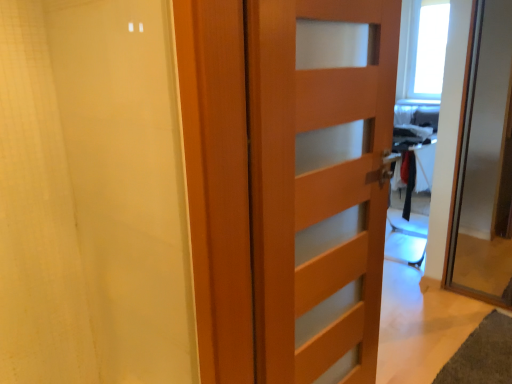
The height and width of the screenshot is (384, 512). In order to click on wooden door at right, arranged as the 2th door when viewed from the left in this screenshot , I will do `click(485, 164)`.

You are a GUI agent. You are given a task and a screenshot of the screen. Output one action in this format:
    pyautogui.click(x=<x>, y=<y>)
    Task: Click on the wooden door at right, arranged as the 2th door when viewed from the left
    The width and height of the screenshot is (512, 384).
    Given the screenshot: What is the action you would take?
    pyautogui.click(x=485, y=164)

How different are the orientations of wooden door at right, which appears as the first door when viewed from the right, and wooden door at center, the 1th door positioned from the left, in degrees?

88 degrees separate the facing orientations of wooden door at right, which appears as the first door when viewed from the right, and wooden door at center, the 1th door positioned from the left.

How much distance is there between wooden door at right, arranged as the 2th door when viewed from the left, and wooden door at center, the 1th door positioned from the left?

wooden door at right, arranged as the 2th door when viewed from the left, and wooden door at center, the 1th door positioned from the left, are 5.17 feet apart from each other.

The image size is (512, 384). What are the coordinates of `door that appears below the wooden door at right, which appears as the first door when viewed from the right (from a real-world perspective)` in the screenshot? It's located at (318, 187).

Based on the photo, can you confirm if wooden door at right, arranged as the 2th door when viewed from the left, is taller than wooden door at center, which is the second door in right-to-left order?

In fact, wooden door at right, arranged as the 2th door when viewed from the left, may be shorter than wooden door at center, which is the second door in right-to-left order.

Is wooden door at center, which is the second door in right-to-left order, inside the boundaries of wooden door at right, arranged as the 2th door when viewed from the left, or outside?

wooden door at center, which is the second door in right-to-left order, is not inside wooden door at right, arranged as the 2th door when viewed from the left, it's outside.

Does wooden door at center, the 1th door positioned from the left, have a greater width compared to wooden door at right, arranged as the 2th door when viewed from the left?

No, wooden door at center, the 1th door positioned from the left, is not wider than wooden door at right, arranged as the 2th door when viewed from the left.

Does wooden door at center, which is the second door in right-to-left order, have a smaller size compared to wooden door at right, arranged as the 2th door when viewed from the left?

Yes.

Is wooden door at center, the 1th door positioned from the left, taller or shorter than wooden door at right, arranged as the 2th door when viewed from the left?

In the image, wooden door at center, the 1th door positioned from the left, appears to be taller than wooden door at right, arranged as the 2th door when viewed from the left.

Considering the positions of objects white matte shower curtain at left and wooden door at center, which is the second door in right-to-left order, in the image provided, who is more to the right, white matte shower curtain at left or wooden door at center, which is the second door in right-to-left order,?

Positioned to the right is wooden door at center, which is the second door in right-to-left order.

Which point is more forward, (67, 206) or (300, 78)?

The point (300, 78) is more forward.

Does white matte shower curtain at left have a lesser height compared to wooden door at center, the 1th door positioned from the left?

Yes, white matte shower curtain at left is shorter than wooden door at center, the 1th door positioned from the left.

Considering the relative sizes of white matte shower curtain at left and wooden door at center, the 1th door positioned from the left, in the image provided, is white matte shower curtain at left bigger than wooden door at center, the 1th door positioned from the left,?

Indeed, white matte shower curtain at left has a larger size compared to wooden door at center, the 1th door positioned from the left.

Is the position of white matte shower curtain at left more distant than that of wooden door at right, arranged as the 2th door when viewed from the left?

No, it is in front of wooden door at right, arranged as the 2th door when viewed from the left.

Is white matte shower curtain at left oriented towards wooden door at right, which appears as the first door when viewed from the right?

No, white matte shower curtain at left is not facing towards wooden door at right, which appears as the first door when viewed from the right.

Is white matte shower curtain at left bigger or smaller than wooden door at right, which appears as the first door when viewed from the right?

white matte shower curtain at left is smaller than wooden door at right, which appears as the first door when viewed from the right.

Do you think wooden door at center, which is the second door in right-to-left order, is within white matte shower curtain at left, or outside of it?

wooden door at center, which is the second door in right-to-left order, cannot be found inside white matte shower curtain at left.

Considering the sizes of objects wooden door at center, which is the second door in right-to-left order, and white matte shower curtain at left in the image provided, who is wider, wooden door at center, which is the second door in right-to-left order, or white matte shower curtain at left?

With larger width is white matte shower curtain at left.

Is wooden door at center, which is the second door in right-to-left order, turned away from white matte shower curtain at left?

No, wooden door at center, which is the second door in right-to-left order,'s orientation is not away from white matte shower curtain at left.

Which of these two, wooden door at center, the 1th door positioned from the left, or white matte shower curtain at left, stands shorter?

Standing shorter between the two is white matte shower curtain at left.

From a real-world perspective, is wooden door at right, which appears as the first door when viewed from the right, under white matte shower curtain at left?

Correct, in the physical world, wooden door at right, which appears as the first door when viewed from the right, is lower than white matte shower curtain at left.

In the scene shown: Does wooden door at right, arranged as the 2th door when viewed from the left, have a lesser width compared to white matte shower curtain at left?

In fact, wooden door at right, arranged as the 2th door when viewed from the left, might be wider than white matte shower curtain at left.

Which is correct: wooden door at right, arranged as the 2th door when viewed from the left, is inside white matte shower curtain at left, or outside of it?

wooden door at right, arranged as the 2th door when viewed from the left, is not inside white matte shower curtain at left, it's outside.

Looking at this image, can you tell me how much wooden door at right, arranged as the 2th door when viewed from the left, and white matte shower curtain at left differ in facing direction?

The angular difference between wooden door at right, arranged as the 2th door when viewed from the left, and white matte shower curtain at left is 86.1 degrees.

Locate an element on the screen. door located above the wooden door at center, which is the second door in right-to-left order (from a real-world perspective) is located at coordinates (485, 164).

Identify the location of door on the left of wooden door at right, arranged as the 2th door when viewed from the left. (318, 187).

Which object lies nearer to the anchor point white matte shower curtain at left, wooden door at center, which is the second door in right-to-left order, or wooden door at right, which appears as the first door when viewed from the right?

Among the two, wooden door at center, which is the second door in right-to-left order, is located nearer to white matte shower curtain at left.

Considering their positions, is white matte shower curtain at left positioned further to wooden door at center, the 1th door positioned from the left, than wooden door at right, arranged as the 2th door when viewed from the left?

The object further to wooden door at center, the 1th door positioned from the left, is wooden door at right, arranged as the 2th door when viewed from the left.

From the image, which object appears to be farther from white matte shower curtain at left, wooden door at right, which appears as the first door when viewed from the right, or wooden door at center, which is the second door in right-to-left order?

wooden door at right, which appears as the first door when viewed from the right, is positioned further to the anchor white matte shower curtain at left.

From the image, which object appears to be nearer to wooden door at right, arranged as the 2th door when viewed from the left, white matte shower curtain at left or wooden door at center, which is the second door in right-to-left order?

The object closer to wooden door at right, arranged as the 2th door when viewed from the left, is wooden door at center, which is the second door in right-to-left order.

From the picture: Considering their positions, is wooden door at center, which is the second door in right-to-left order, positioned further to wooden door at right, which appears as the first door when viewed from the right, than white matte shower curtain at left?

Based on the image, white matte shower curtain at left appears to be further to wooden door at right, which appears as the first door when viewed from the right.

Estimate the real-world distances between objects in this image. Which object is further from wooden door at center, the 1th door positioned from the left, wooden door at right, which appears as the first door when viewed from the right, or white matte shower curtain at left?

wooden door at right, which appears as the first door when viewed from the right.

Find the location of a particular element. door located between white matte shower curtain at left and wooden door at right, arranged as the 2th door when viewed from the left, in the left-right direction is located at coordinates (318, 187).